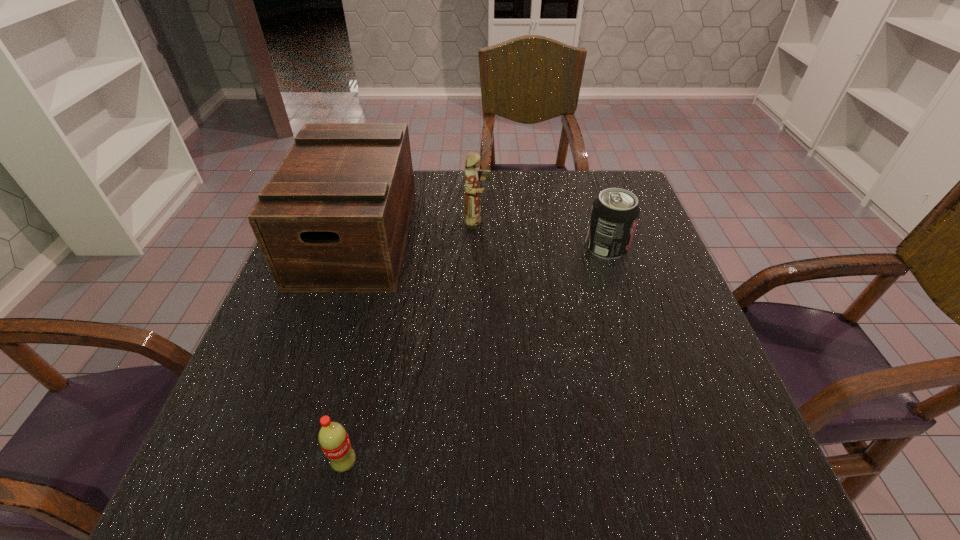
This screenshot has width=960, height=540. Identify the location of box at the far edge. (334, 218).

Where is `figurine located in the far edge section of the desktop`? The width and height of the screenshot is (960, 540). figurine located in the far edge section of the desktop is located at coordinates (473, 219).

At what (x,y) coordinates should I click in order to perform the action: click on object present at the near edge. Please return your answer as a coordinate pair (x, y). Image resolution: width=960 pixels, height=540 pixels. Looking at the image, I should click on (333, 439).

This screenshot has height=540, width=960. In order to click on object that is at the left edge in this screenshot , I will do `click(334, 218)`.

The height and width of the screenshot is (540, 960). Find the location of `object present at the right edge`. object present at the right edge is located at coordinates (614, 215).

Where is `object situated at the far left corner`? object situated at the far left corner is located at coordinates (334, 218).

At what (x,y) coordinates should I click in order to perform the action: click on vacant area at the far edge of the desktop. Please return your answer as a coordinate pair (x, y). This screenshot has height=540, width=960. Looking at the image, I should click on pyautogui.click(x=418, y=192).

The height and width of the screenshot is (540, 960). What are the coordinates of `vacant space at the left edge` in the screenshot? It's located at (288, 388).

Find the location of a particular element. This screenshot has height=540, width=960. free space at the right edge of the desktop is located at coordinates (662, 398).

I want to click on vacant space at the near right corner of the desktop, so click(x=690, y=492).